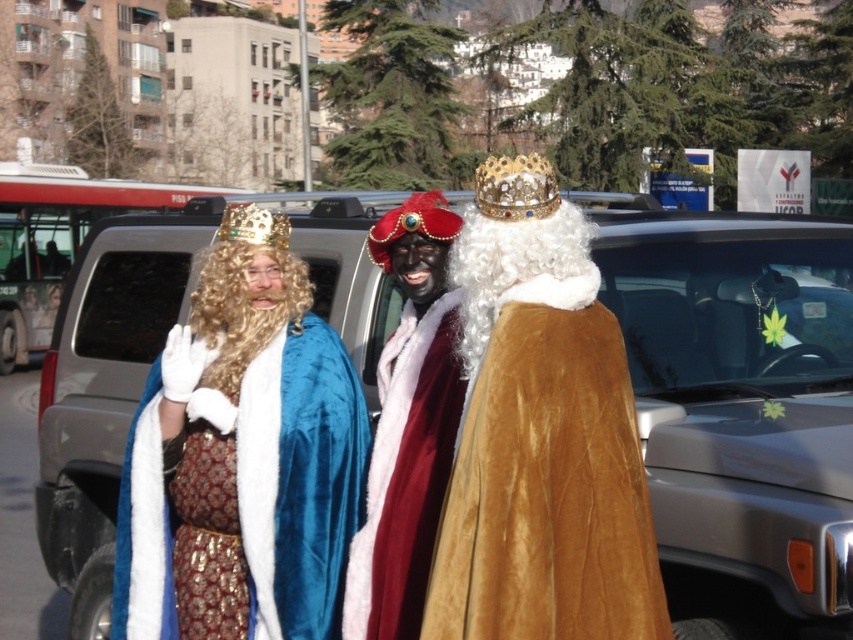
Which of these two, metallic silver car at center or velvet blue cape at center, stands shorter?

With less height is velvet blue cape at center.

Based on the photo, is metallic silver car at center positioned in front of velvet blue cape at center?

Yes, it is in front of velvet blue cape at center.

Is point (74, 433) positioned in front of point (312, 460)?

No.

The width and height of the screenshot is (853, 640). I want to click on metallic silver car at center, so click(x=740, y=406).

Does brown velvet cape at center lie behind gold jeweled crown at center?

A: No, brown velvet cape at center is closer to the viewer.

Can you confirm if brown velvet cape at center is bigger than gold jeweled crown at center?

No, brown velvet cape at center is not bigger than gold jeweled crown at center.

Locate an element on the screen. brown velvet cape at center is located at coordinates (547, 483).

The image size is (853, 640). I want to click on brown velvet cape at center, so click(x=547, y=483).

Who is positioned more to the left, gold jeweled crown at center or gold metallic crown at center?

From the viewer's perspective, gold metallic crown at center appears more on the left side.

Is the position of gold jeweled crown at center less distant than that of gold metallic crown at center?

That is True.

Does point (531, 172) come closer to viewer compared to point (247, 212)?

Yes.

I want to click on gold jeweled crown at center, so click(x=515, y=188).